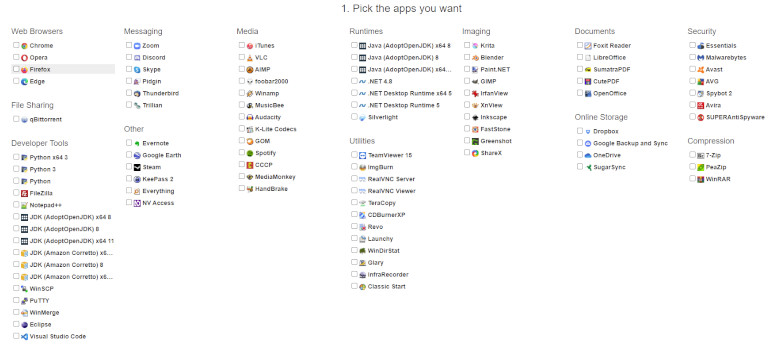
This screenshot has width=768, height=347. Identify the location of documents. (614, 46), (616, 63), (617, 70), (617, 81), (617, 93).